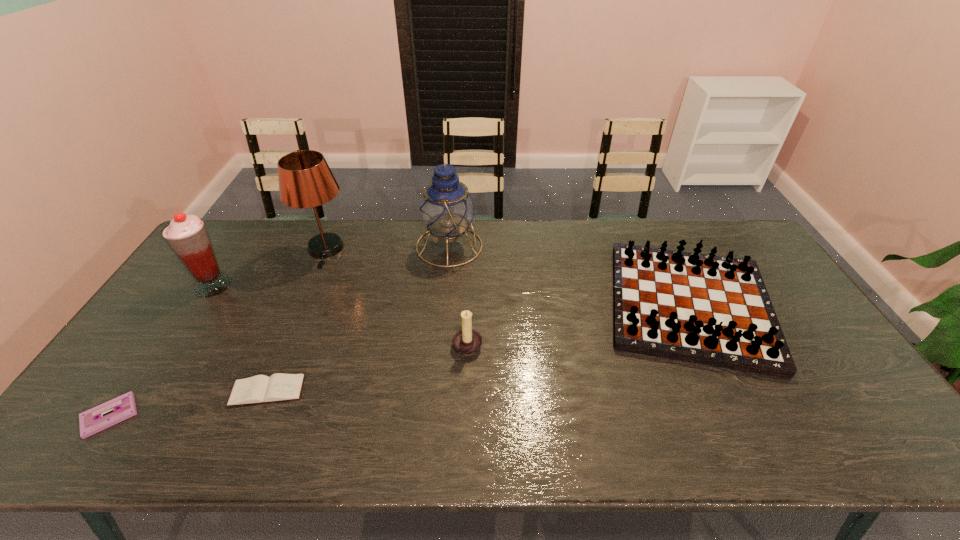
Identify the location of videotape that is at the left edge. The image size is (960, 540). (91, 421).

This screenshot has height=540, width=960. I want to click on object positioned at the right edge, so click(706, 309).

I want to click on object that is positioned at the near left corner, so click(x=91, y=421).

The image size is (960, 540). I want to click on object that is positioned at the far right corner, so click(706, 309).

In the image, there is a desktop. Where is `vacant space at the far edge`? This screenshot has width=960, height=540. vacant space at the far edge is located at coordinates (655, 219).

You are a GUI agent. You are given a task and a screenshot of the screen. Output one action in this format:
    pyautogui.click(x=<x>, y=<y>)
    Task: Click on the free space at the near edge
    
    Given the screenshot: What is the action you would take?
    pyautogui.click(x=474, y=422)

This screenshot has height=540, width=960. Find the location of `vacant region at the left edge of the desktop`. vacant region at the left edge of the desktop is located at coordinates (127, 392).

Identify the location of vacant space at the right edge of the desktop. The height and width of the screenshot is (540, 960). (768, 268).

This screenshot has height=540, width=960. In order to click on vacant space at the far right corner of the desktop in this screenshot , I will do `click(722, 226)`.

The image size is (960, 540). I want to click on free area in between the lampshade and the second shortest object, so click(296, 320).